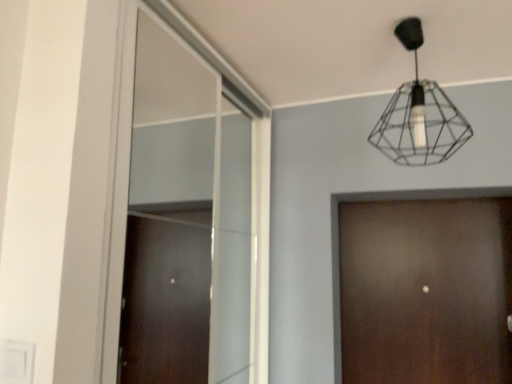
What do you see at coordinates (183, 219) in the screenshot?
I see `clear glass window at center` at bounding box center [183, 219].

Image resolution: width=512 pixels, height=384 pixels. Identify the location of brown wood door at center. (426, 291).

Looking at this image, from the image's perspective, which object appears higher, clear glass window at center or brown wood door at center?

From the image's view, clear glass window at center is above.

Considering the positions of objects clear glass window at center and brown wood door at center in the image provided, who is more to the right, clear glass window at center or brown wood door at center?

From the viewer's perspective, brown wood door at center appears more on the right side.

Consider the image. Considering the sizes of objects clear glass window at center and brown wood door at center in the image provided, who is wider, clear glass window at center or brown wood door at center?

Wider between the two is brown wood door at center.

Is clear glass window at center smaller than brown wood door at center?

No.

Is clear glass window at center next to wireframe black lamp at upper center and touching it?

They are not placed beside each other.

From the picture: Is clear glass window at center aimed at wireframe black lamp at upper center?

Yes, clear glass window at center faces towards wireframe black lamp at upper center.

Relative to wireframe black lamp at upper center, is clear glass window at center in front or behind?

clear glass window at center is in front of wireframe black lamp at upper center.

From the picture: How different are the orientations of clear glass window at center and wireframe black lamp at upper center in degrees?

92.8 degrees separate the facing orientations of clear glass window at center and wireframe black lamp at upper center.

From the image's perspective, which one is positioned lower, wireframe black lamp at upper center or clear glass window at center?

clear glass window at center appears lower in the image.

Considering the relative sizes of wireframe black lamp at upper center and clear glass window at center in the image provided, is wireframe black lamp at upper center shorter than clear glass window at center?

Yes.

Is wireframe black lamp at upper center positioned with its back to clear glass window at center?

That's not correct — wireframe black lamp at upper center is not looking away from clear glass window at center.

Between wireframe black lamp at upper center and clear glass window at center, which one has larger size?

With larger size is clear glass window at center.

Could you tell me if brown wood door at center is turned towards clear glass window at center?

Yes, brown wood door at center is oriented towards clear glass window at center.

Measure the distance between brown wood door at center and clear glass window at center.

brown wood door at center and clear glass window at center are 33.33 inches apart.

Can you tell me how much brown wood door at center and clear glass window at center differ in facing direction?

The facing directions of brown wood door at center and clear glass window at center are 91.4 degrees apart.

Consider the image. Between brown wood door at center and clear glass window at center, which one has larger size?

clear glass window at center.

Can you see brown wood door at center touching wireframe black lamp at upper center?

No, brown wood door at center is not making contact with wireframe black lamp at upper center.

From a real-world perspective, which object rests below the other?

brown wood door at center.

Identify the location of lamp on the left of brown wood door at center. Image resolution: width=512 pixels, height=384 pixels. (419, 115).

Does wireframe black lamp at upper center touch brown wood door at center?

wireframe black lamp at upper center and brown wood door at center are clearly separated.

From the image's perspective, is wireframe black lamp at upper center located beneath brown wood door at center?

No, from the image's perspective, wireframe black lamp at upper center is not below brown wood door at center.

Does wireframe black lamp at upper center appear on the left side of brown wood door at center?

Yes.

Based on the photo, does wireframe black lamp at upper center come behind brown wood door at center?

No, wireframe black lamp at upper center is closer to the viewer.

Find the location of a particular element. Image resolution: width=512 pixels, height=384 pixels. door behind the clear glass window at center is located at coordinates (426, 291).

Where is `window below the wireframe black lamp at upper center (from a real-world perspective)`? window below the wireframe black lamp at upper center (from a real-world perspective) is located at coordinates (183, 219).

From the image, which object appears to be farther from clear glass window at center, wireframe black lamp at upper center or brown wood door at center?

wireframe black lamp at upper center is further to clear glass window at center.

Considering their positions, is clear glass window at center positioned further to wireframe black lamp at upper center than brown wood door at center?

clear glass window at center is positioned further to the anchor wireframe black lamp at upper center.

Looking at this image, based on their spatial positions, is clear glass window at center or wireframe black lamp at upper center closer to brown wood door at center?

wireframe black lamp at upper center is closer to brown wood door at center.

Estimate the real-world distances between objects in this image. Which object is further from clear glass window at center, brown wood door at center or wireframe black lamp at upper center?

The object further to clear glass window at center is wireframe black lamp at upper center.

Estimate the real-world distances between objects in this image. Which object is closer to wireframe black lamp at upper center, brown wood door at center or clear glass window at center?

brown wood door at center is closer to wireframe black lamp at upper center.

From the image, which object appears to be nearer to brown wood door at center, wireframe black lamp at upper center or clear glass window at center?

Based on the image, wireframe black lamp at upper center appears to be nearer to brown wood door at center.

Identify the location of lamp between clear glass window at center and brown wood door at center from left to right. The width and height of the screenshot is (512, 384). (419, 115).